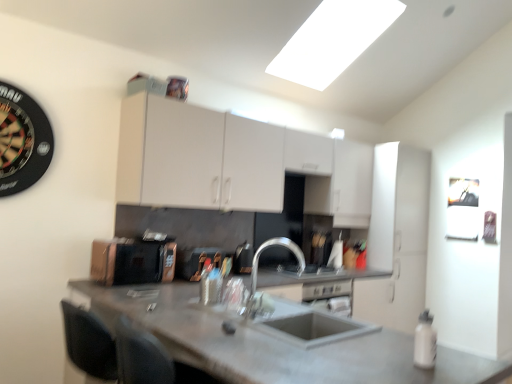
Question: Can you confirm if white matte bottle at lower right is smaller than matte copper toaster at center, which appears as the third appliance when viewed from the right?

Choices:
 (A) yes
 (B) no

Answer: (A)

Question: Is white matte bottle at lower right not inside matte copper toaster at center, which appears as the third appliance when viewed from the right?

Choices:
 (A) no
 (B) yes

Answer: (B)

Question: Is white matte bottle at lower right with matte copper toaster at center, which is the first appliance from left to right?

Choices:
 (A) yes
 (B) no

Answer: (B)

Question: Considering the relative sizes of white matte bottle at lower right and matte copper toaster at center, which is the first appliance from left to right, in the image provided, is white matte bottle at lower right taller than matte copper toaster at center, which is the first appliance from left to right,?

Choices:
 (A) no
 (B) yes

Answer: (A)

Question: Could matte copper toaster at center, which is the first appliance from left to right, be considered to be inside white matte bottle at lower right?

Choices:
 (A) no
 (B) yes

Answer: (A)

Question: Is white matte bottle at lower right facing away from matte copper toaster at center, which is the first appliance from left to right?

Choices:
 (A) no
 (B) yes

Answer: (A)

Question: Is concrete gray countertop at center closer to the viewer compared to white matte cabinet at upper center, the 1th cabinetry from the left?

Choices:
 (A) yes
 (B) no

Answer: (A)

Question: From a real-world perspective, is concrete gray countertop at center located beneath white matte cabinet at upper center, the 1th cabinetry from the left?

Choices:
 (A) no
 (B) yes

Answer: (B)

Question: Is white matte cabinet at upper center, the second cabinetry positioned from the right, at the back of concrete gray countertop at center?

Choices:
 (A) no
 (B) yes

Answer: (A)

Question: Is concrete gray countertop at center shorter than white matte cabinet at upper center, the 1th cabinetry from the left?

Choices:
 (A) yes
 (B) no

Answer: (B)

Question: Is concrete gray countertop at center not close to white matte cabinet at upper center, the second cabinetry positioned from the right?

Choices:
 (A) no
 (B) yes

Answer: (B)

Question: Considering the relative positions of concrete gray countertop at center and white matte cabinet at upper center, the second cabinetry positioned from the right, in the image provided, is concrete gray countertop at center behind white matte cabinet at upper center, the second cabinetry positioned from the right,?

Choices:
 (A) yes
 (B) no

Answer: (B)

Question: Does metallic silver toaster at center, which ranks as the 2th appliance in right-to-left order, have a greater width compared to white matte bottle at lower right?

Choices:
 (A) yes
 (B) no

Answer: (A)